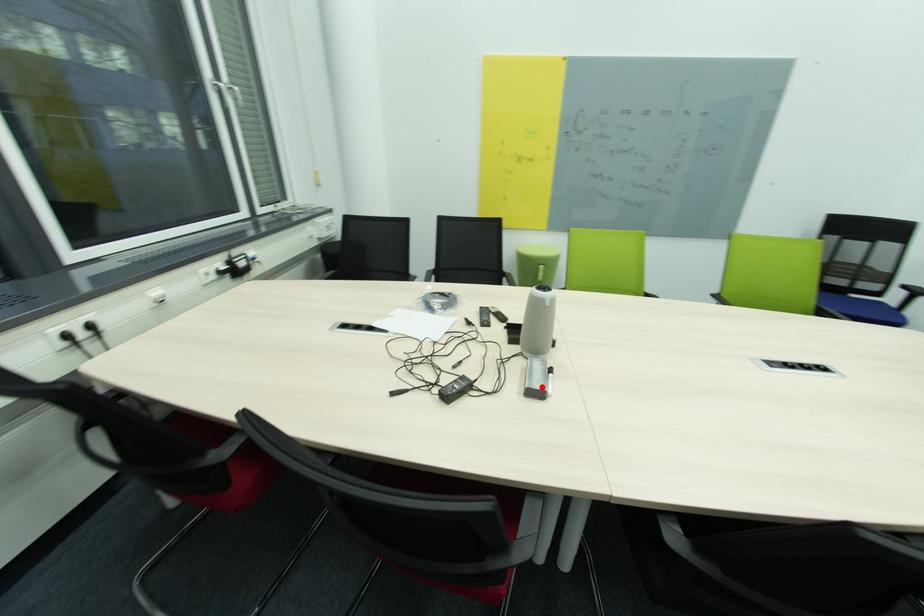
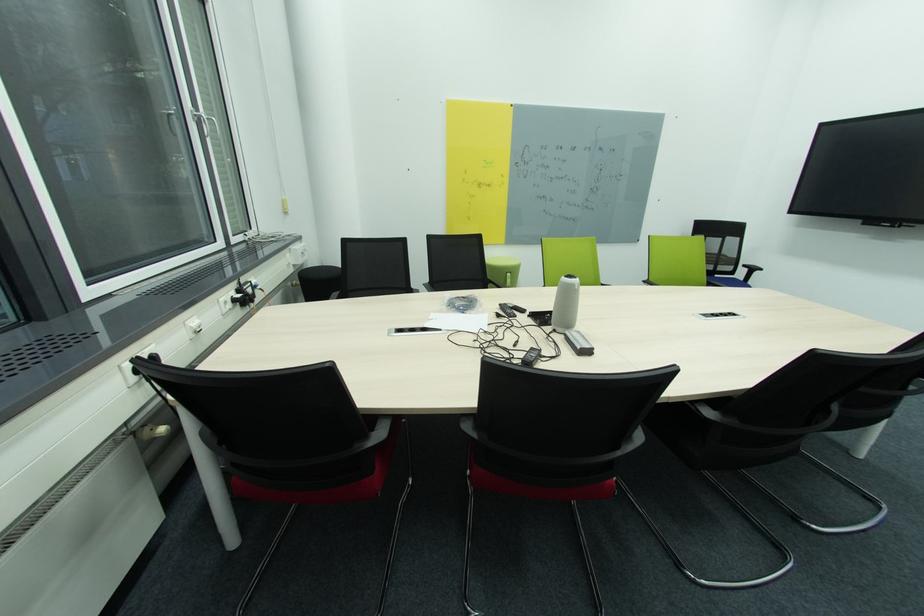
The point at the highlighted location is marked in the first image. Where is the corresponding point in the second image?

(591, 347)